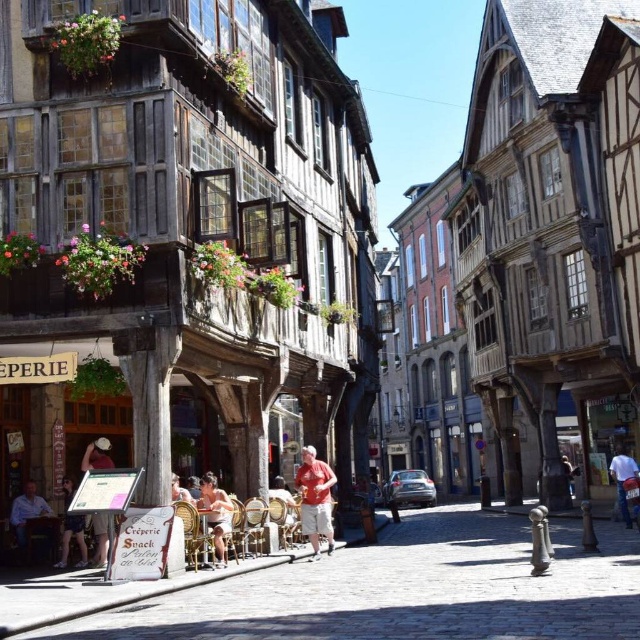
Question: Can you confirm if red cotton shirt at center is positioned to the left of matte white hat at center?

Choices:
 (A) no
 (B) yes

Answer: (A)

Question: Considering the relative positions of red cotton shirt at center and matte white hat at center in the image provided, where is red cotton shirt at center located with respect to matte white hat at center?

Choices:
 (A) above
 (B) below

Answer: (B)

Question: Based on their relative distances, which object is nearer to the red cotton shirt at center?

Choices:
 (A) matte red shirt at center
 (B) white cotton shirt at center
 (C) light brown wooden chair at lower left

Answer: (A)

Question: Is denim shorts at lower left to the right of matte red shirt at center from the viewer's perspective?

Choices:
 (A) yes
 (B) no

Answer: (B)

Question: Which point appears farthest from the camera in this image?

Choices:
 (A) (176, 492)
 (B) (628, 460)
 (C) (205, 509)

Answer: (B)

Question: Which of the following is the closest to the observer?

Choices:
 (A) white cotton shirt at center
 (B) red cotton shirt at center
 (C) matte white hat at center

Answer: (C)